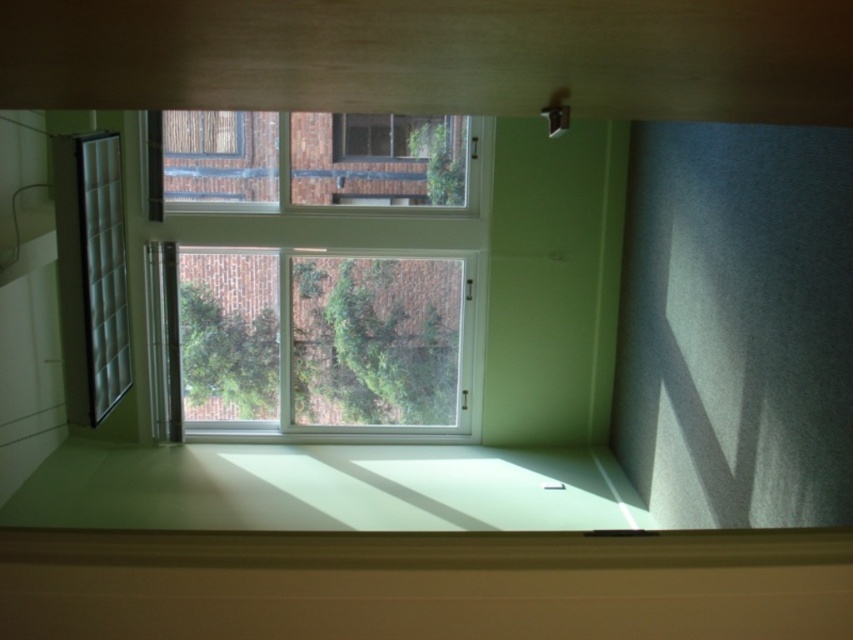
You are standing outside the window and want to see the brick building clearly. Which curtain, the white matte curtain at right or the translucent fabric curtain at left, should you move aside to have a better view?

The translucent fabric curtain at left allows more visibility than the white matte curtain at right, so moving it aside would provide a clearer view of the brick building.

You are standing outside the window and want to enter the room. The white plastic window at center and the translucent fabric curtain at left are in your way. Which object should you move first to get inside?

You should move the translucent fabric curtain at left first because the white plastic window at center is below it, meaning the curtain is closer to you and can be moved out of the way before dealing with the window.